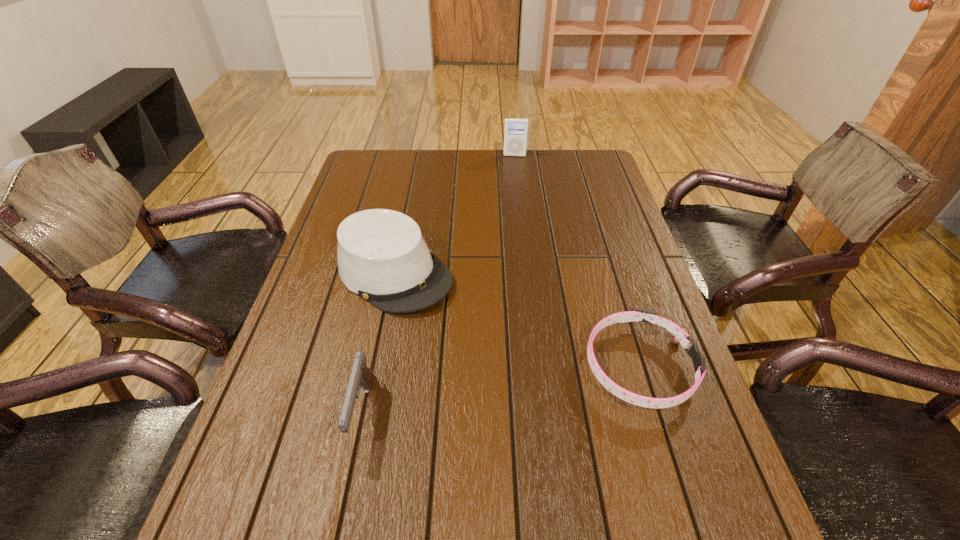
Where is `vacant space at the right edge of the desktop`? The image size is (960, 540). vacant space at the right edge of the desktop is located at coordinates (603, 264).

I want to click on vacant space at the far left corner, so click(x=364, y=174).

Locate an element on the screen. blank area at the near left corner is located at coordinates (250, 446).

In the image, there is a desktop. At what (x,y) coordinates should I click in order to perform the action: click on vacant region at the far right corner. Please return your answer as a coordinate pair (x, y). Looking at the image, I should click on (598, 171).

This screenshot has height=540, width=960. I want to click on vacant region at the near right corner, so click(x=636, y=469).

Find the location of `vacant space in between the pistol and the shortest object`. vacant space in between the pistol and the shortest object is located at coordinates (500, 389).

Where is `empty space that is in between the iPod and the third nearest object`? The height and width of the screenshot is (540, 960). empty space that is in between the iPod and the third nearest object is located at coordinates (454, 214).

At what (x,y) coordinates should I click in order to perform the action: click on vacant area that lies between the second object from right to left and the third nearest object. Please return your answer as a coordinate pair (x, y). The image size is (960, 540). Looking at the image, I should click on (454, 214).

Locate an element on the screen. Image resolution: width=960 pixels, height=540 pixels. free point between the rightmost object and the second farthest object is located at coordinates (516, 320).

This screenshot has height=540, width=960. I want to click on free space between the pistol and the dog collar, so click(x=500, y=389).